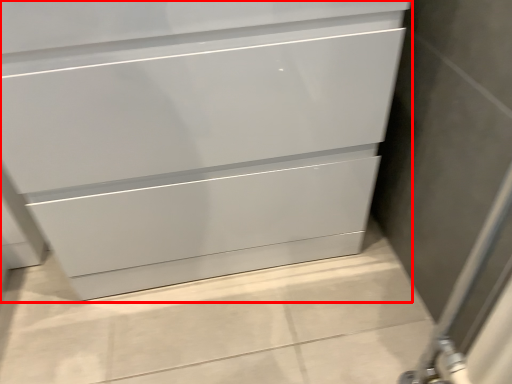
Question: Considering the relative positions of chest of drawers (annotated by the red box) and screen door in the image provided, where is chest of drawers (annotated by the red box) located with respect to the staircase?

Choices:
 (A) right
 (B) left

Answer: (B)